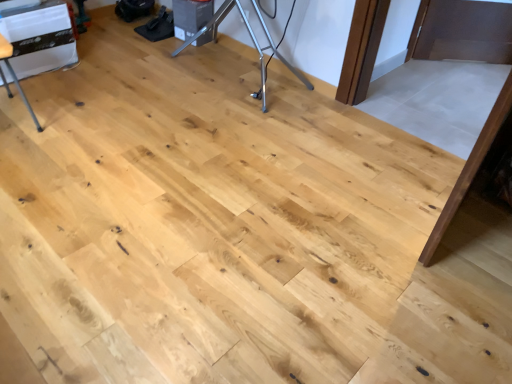
Where is `vacant space that is in between white plastic table at upper left and matte white appliance at left`? vacant space that is in between white plastic table at upper left and matte white appliance at left is located at coordinates (48, 92).